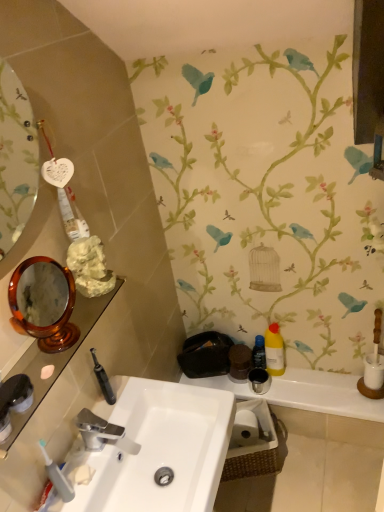
Question: Is translucent plastic toothbrush at lower left shorter than black plastic bottle at right, the 1th mouthwash in the left-to-right sequence?

Choices:
 (A) no
 (B) yes

Answer: (A)

Question: Is translucent plastic toothbrush at lower left completely or partially outside of black plastic bottle at right, the 1th mouthwash in the left-to-right sequence?

Choices:
 (A) yes
 (B) no

Answer: (A)

Question: From the image's perspective, is translucent plastic toothbrush at lower left on black plastic bottle at right, which is counted as the 2th mouthwash, starting from the right?

Choices:
 (A) yes
 (B) no

Answer: (B)

Question: Considering the relative sizes of translucent plastic toothbrush at lower left and black plastic bottle at right, which is counted as the 2th mouthwash, starting from the right, in the image provided, is translucent plastic toothbrush at lower left wider than black plastic bottle at right, which is counted as the 2th mouthwash, starting from the right,?

Choices:
 (A) no
 (B) yes

Answer: (A)

Question: Could you tell me if translucent plastic toothbrush at lower left is facing black plastic bottle at right, which is counted as the 2th mouthwash, starting from the right?

Choices:
 (A) yes
 (B) no

Answer: (B)

Question: Is black plastic bottle at right, which is counted as the 2th mouthwash, starting from the right, inside translucent plastic toothbrush at lower left?

Choices:
 (A) no
 (B) yes

Answer: (A)

Question: Does yellow matte bottle at right, placed as the 2th mouthwash when sorted from left to right, turn towards white glossy sink at center?

Choices:
 (A) no
 (B) yes

Answer: (B)

Question: Can you confirm if yellow matte bottle at right, placed as the 2th mouthwash when sorted from left to right, is thinner than white glossy sink at center?

Choices:
 (A) yes
 (B) no

Answer: (A)

Question: Does yellow matte bottle at right, placed as the 2th mouthwash when sorted from left to right, lie behind white glossy sink at center?

Choices:
 (A) no
 (B) yes

Answer: (B)

Question: From the image's perspective, is yellow matte bottle at right, the 1th mouthwash viewed from the right, on white glossy sink at center?

Choices:
 (A) yes
 (B) no

Answer: (A)

Question: From a real-world perspective, does yellow matte bottle at right, placed as the 2th mouthwash when sorted from left to right, stand above white glossy sink at center?

Choices:
 (A) yes
 (B) no

Answer: (B)

Question: From a real-world perspective, does yellow matte bottle at right, placed as the 2th mouthwash when sorted from left to right, sit lower than white glossy sink at center?

Choices:
 (A) no
 (B) yes

Answer: (B)

Question: Can you confirm if translucent plastic toothbrush at lower left is shorter than white matte toilet paper at lower center?

Choices:
 (A) yes
 (B) no

Answer: (B)